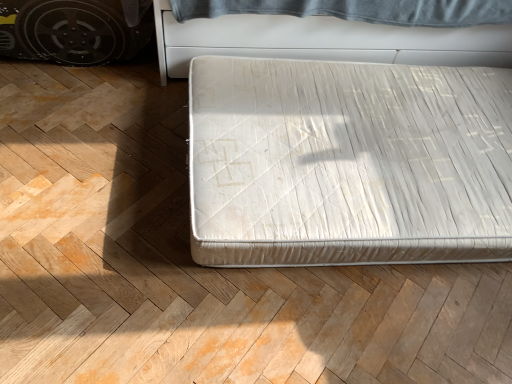
Question: Is white fabric mattress at center in front of or behind white fabric bed at center in the image?

Choices:
 (A) front
 (B) behind

Answer: (B)

Question: Based on their sizes in the image, would you say white fabric mattress at center is bigger or smaller than white fabric bed at center?

Choices:
 (A) small
 (B) big

Answer: (B)

Question: In terms of width, does white fabric mattress at center look wider or thinner when compared to white fabric bed at center?

Choices:
 (A) wide
 (B) thin

Answer: (B)

Question: Do you think white fabric bed at center is within white fabric mattress at center, or outside of it?

Choices:
 (A) outside
 (B) inside

Answer: (A)

Question: From the image's perspective, is white fabric bed at center above or below white fabric mattress at center?

Choices:
 (A) below
 (B) above

Answer: (A)

Question: In terms of width, does white fabric bed at center look wider or thinner when compared to white fabric mattress at center?

Choices:
 (A) thin
 (B) wide

Answer: (B)

Question: Is white fabric bed at center bigger or smaller than white fabric mattress at center?

Choices:
 (A) small
 (B) big

Answer: (A)